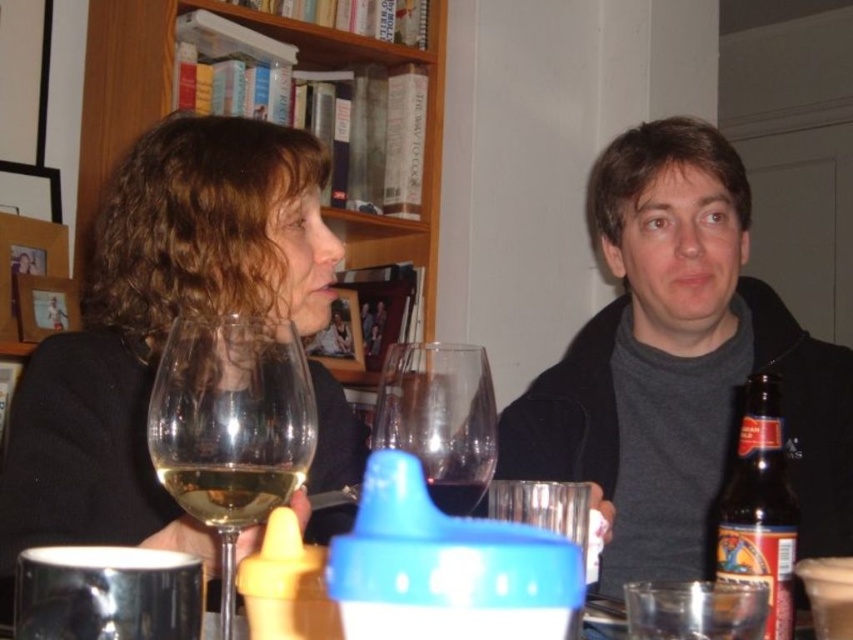
The height and width of the screenshot is (640, 853). Describe the element at coordinates (160, 324) in the screenshot. I see `matte black sweater at upper left` at that location.

Is matte black sweater at upper left shorter than translucent glass wine at center?

No, matte black sweater at upper left is not shorter than translucent glass wine at center.

At what (x,y) coordinates should I click in order to perform the action: click on matte black sweater at upper left. Please return your answer as a coordinate pair (x, y). Image resolution: width=853 pixels, height=640 pixels. Looking at the image, I should click on (160, 324).

Can you confirm if transparent glass wine at left is thinner than transparent glass at center?

In fact, transparent glass wine at left might be wider than transparent glass at center.

Consider the image. Can you confirm if transparent glass wine at left is taller than transparent glass at center?

Result: Yes.

Is point (228, 481) in front of point (450, 502)?

Yes, it is.

Identify the location of transparent glass wine at left. Image resolution: width=853 pixels, height=640 pixels. (231, 426).

Between wooden bookshelf at upper left and transparent glass at center, which one has less height?

With less height is transparent glass at center.

How far apart are wooden bookshelf at upper left and transparent glass at center?

wooden bookshelf at upper left and transparent glass at center are 1.62 meters apart.

The width and height of the screenshot is (853, 640). I want to click on wooden bookshelf at upper left, so click(x=299, y=65).